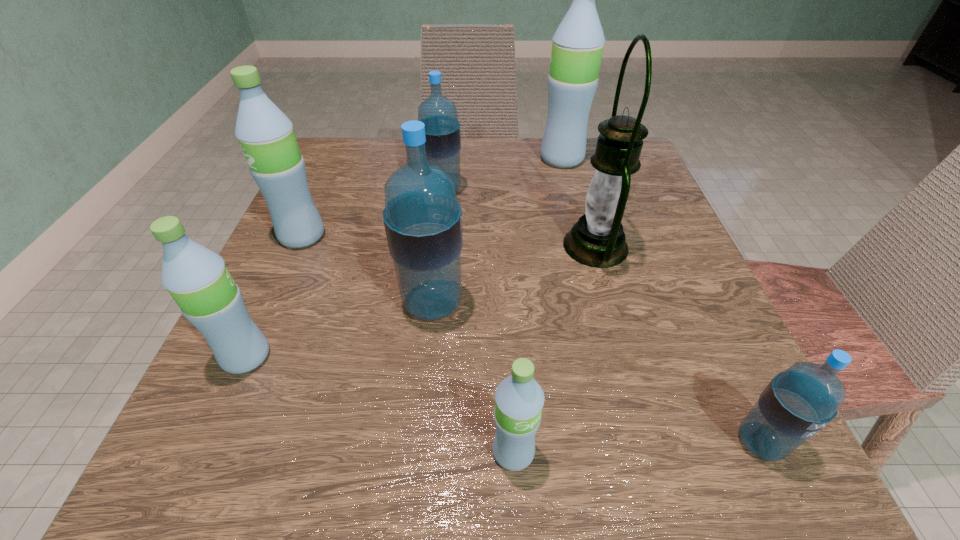
Where is `the farthest green water bottle`? The width and height of the screenshot is (960, 540). the farthest green water bottle is located at coordinates (578, 42).

Find the location of a particular element. This screenshot has height=540, width=960. the rightmost green water bottle is located at coordinates (578, 42).

Locate an element on the screen. lantern is located at coordinates (597, 240).

I want to click on the second farthest green water bottle, so click(x=266, y=136).

I want to click on the third farthest water bottle, so click(x=266, y=136).

Where is `the biggest blue water bottle`? Image resolution: width=960 pixels, height=540 pixels. the biggest blue water bottle is located at coordinates (423, 220).

This screenshot has width=960, height=540. Find the location of `the fourth nearest object`. the fourth nearest object is located at coordinates (423, 220).

You are a GUI agent. You are given a task and a screenshot of the screen. Output one action in this format:
    pyautogui.click(x=<x>, y=<y>)
    Task: Click on the second biggest blue water bottle
    This screenshot has width=960, height=540.
    Given the screenshot: What is the action you would take?
    pyautogui.click(x=442, y=129)

Find the location of a particular element. The width and height of the screenshot is (960, 540). the farthest blue water bottle is located at coordinates (442, 129).

Where is `the third biggest green water bottle`? The height and width of the screenshot is (540, 960). the third biggest green water bottle is located at coordinates (197, 278).